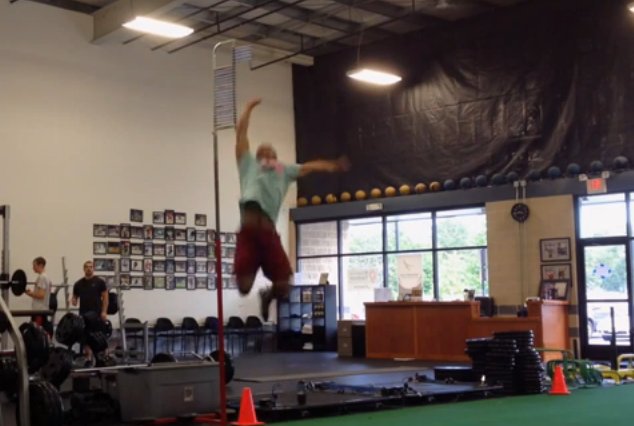
I want to click on long rectangular light, so click(x=365, y=73).